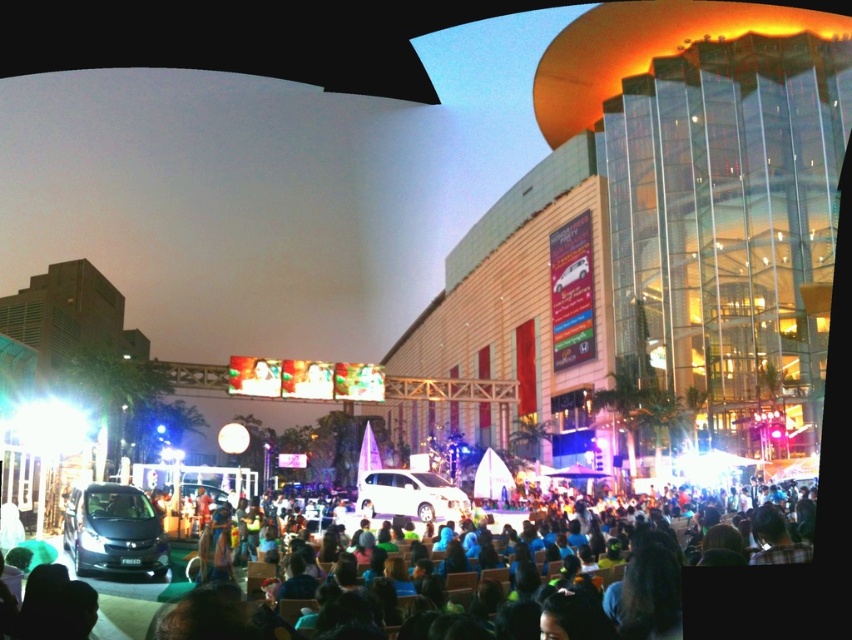
You are attending an outdoor event and notice the green fabric crowd at lower center and the white glossy minivan at center. Which one do you think is wider?

The green fabric crowd at lower center is wider than the white glossy minivan at center.